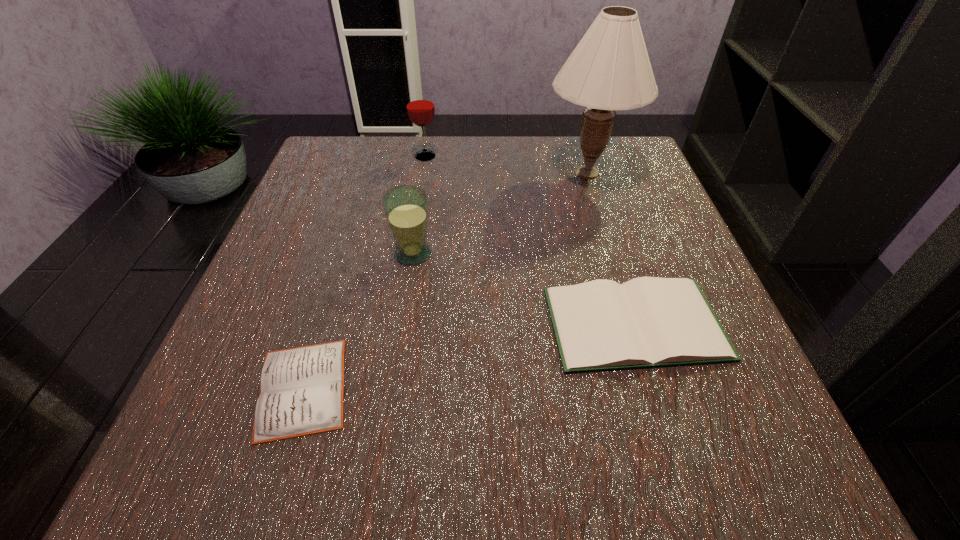
Where is `vacant space located 0.340m on the front of the third farthest object`? vacant space located 0.340m on the front of the third farthest object is located at coordinates (381, 457).

Find the location of a particular element. vacant space positioned on the front of the fourth tallest object is located at coordinates (664, 419).

Where is `vacant area situated 0.180m on the right of the leftmost object`? vacant area situated 0.180m on the right of the leftmost object is located at coordinates (479, 388).

In order to click on lampshade at the far edge in this screenshot , I will do `click(609, 70)`.

This screenshot has width=960, height=540. In order to click on glass that is at the far edge in this screenshot , I will do `click(420, 107)`.

This screenshot has height=540, width=960. In order to click on object at the near edge in this screenshot , I will do `click(302, 389)`.

Locate an element on the screen. object at the left edge is located at coordinates (302, 389).

You are a GUI agent. You are given a task and a screenshot of the screen. Output one action in this format:
    pyautogui.click(x=<x>, y=<y>)
    Task: Click on the lampshade that is at the right edge
    This screenshot has height=540, width=960.
    Given the screenshot: What is the action you would take?
    pyautogui.click(x=609, y=70)

Image resolution: width=960 pixels, height=540 pixels. I want to click on hardback book at the right edge, so click(x=648, y=322).

Where is `object present at the near left corner`? object present at the near left corner is located at coordinates (302, 389).